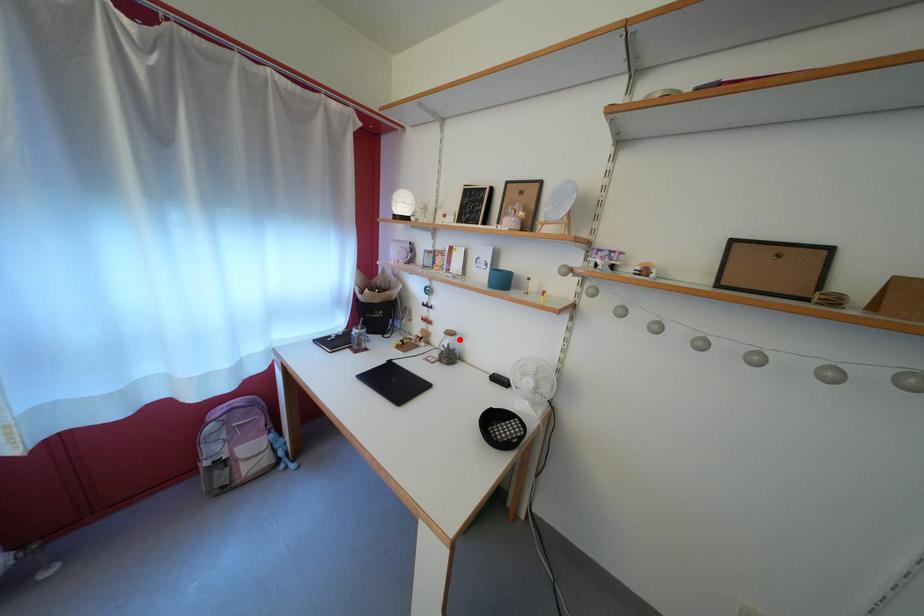
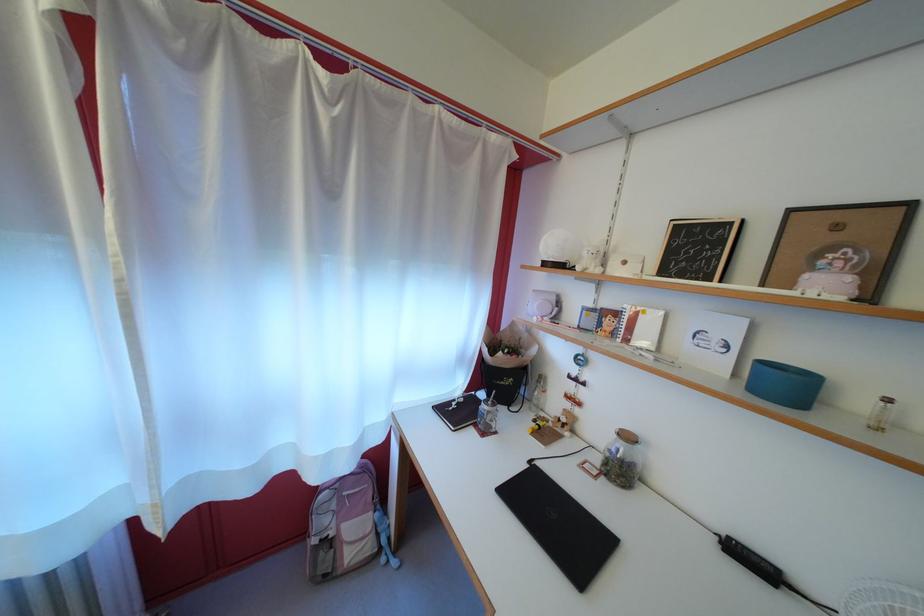
In the second image, find the point that corresponds to the highlighted location in the first image.

(637, 444)